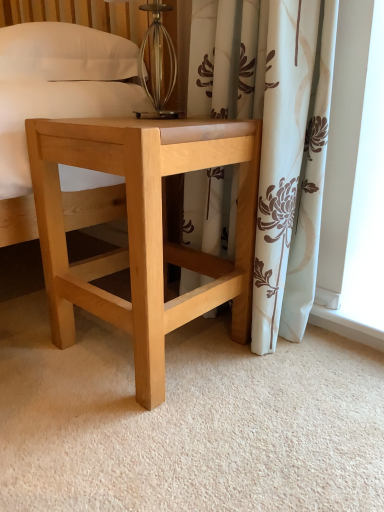
Question: Should I look upward or downward to see natural wood stool at center?

Choices:
 (A) up
 (B) down

Answer: (A)